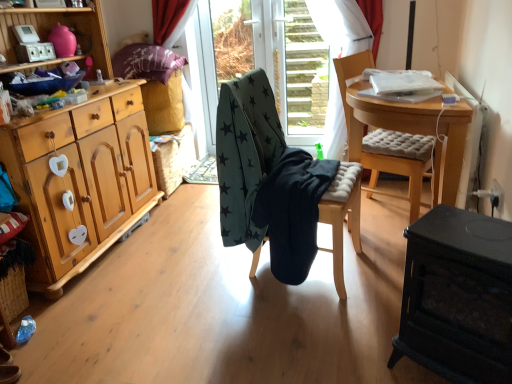
Question: Is teal star-patterned fabric at center, which ranks as the first chair in left-to-right order, inside or outside of dark green fabric stool at center?

Choices:
 (A) outside
 (B) inside

Answer: (B)

Question: From the image's perspective, is teal star-patterned fabric at center, which ranks as the first chair in left-to-right order, above or below dark green fabric stool at center?

Choices:
 (A) above
 (B) below

Answer: (A)

Question: Which object is the closest to the black matte wood table at lower right?

Choices:
 (A) purple floral fabric pillow at upper left
 (B) light wood cabinet at left
 (C) teal star-patterned fabric at center, which ranks as the first chair in left-to-right order
 (D) light brown cushioned chair at center, marked as the 1th chair in a right-to-left arrangement
 (E) transparent plastic screen door at center

Answer: (C)

Question: Which of these objects is positioned closest to the purple floral fabric pillow at upper left?

Choices:
 (A) transparent plastic screen door at center
 (B) transparent glass door at center
 (C) teal star-patterned fabric at center, marked as the 2th chair in a right-to-left arrangement
 (D) light brown cushioned chair at center, marked as the 1th chair in a right-to-left arrangement
 (E) black matte wood table at lower right

Answer: (B)